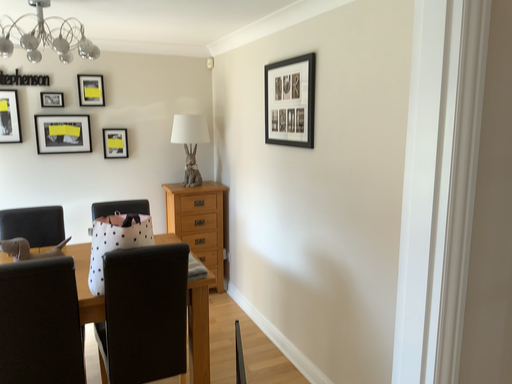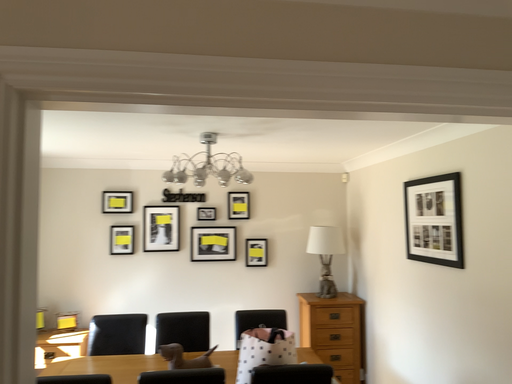
Question: How did the camera likely rotate when shooting the video?

Choices:
 (A) rotated upward
 (B) rotated downward

Answer: (A)